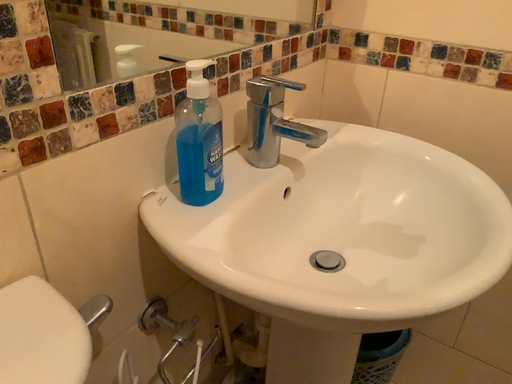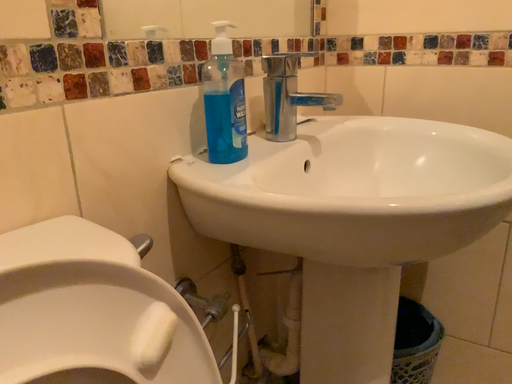
Question: How did the camera likely rotate when shooting the video?

Choices:
 (A) rotated downward
 (B) rotated upward

Answer: (B)